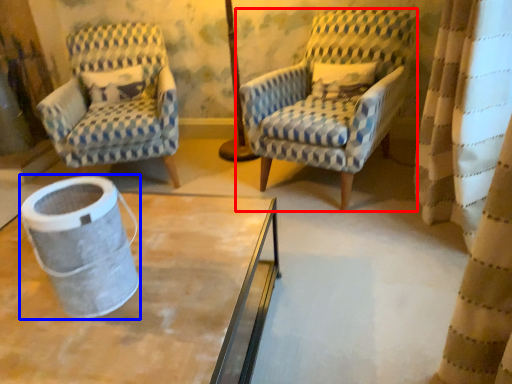
Question: Which object is closer to the camera taking this photo, chair (highlighted by a red box) or gray (highlighted by a blue box)?

Choices:
 (A) chair
 (B) gray

Answer: (B)